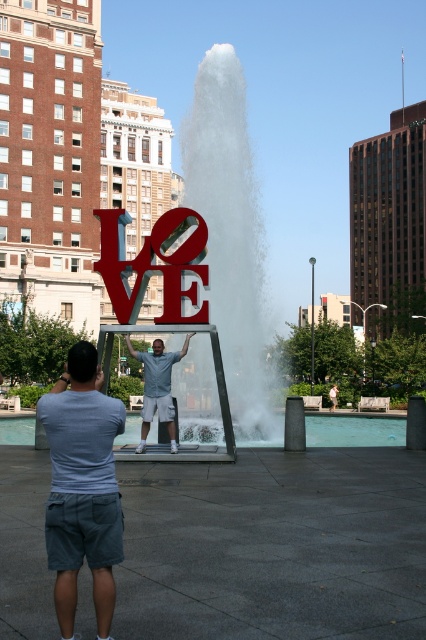
Question: Which point is farther to the camera?

Choices:
 (A) light blue shirt at center
 (B) gray cotton shorts at lower left

Answer: (A)

Question: Which object is closer to the camera taking this photo?

Choices:
 (A) gray cotton shorts at lower left
 (B) light blue shirt at center

Answer: (A)

Question: Does gray cotton shorts at lower left appear on the left side of light blue shirt at center?

Choices:
 (A) no
 (B) yes

Answer: (A)

Question: Where is gray cotton shorts at lower left located in relation to light blue shirt at center in the image?

Choices:
 (A) above
 (B) below

Answer: (A)

Question: Is gray cotton shorts at lower left positioned at the back of light blue shirt at center?

Choices:
 (A) yes
 (B) no

Answer: (B)